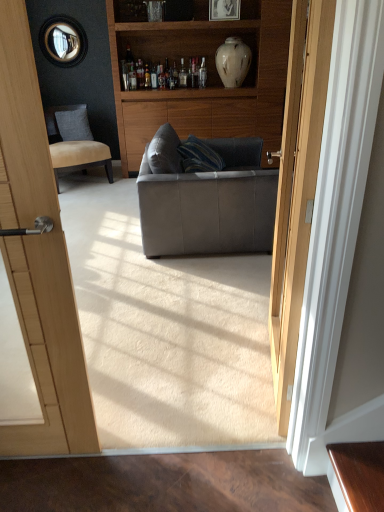
Question: Is white glossy vase at upper center positioned beyond the bounds of suede tan chair at left?

Choices:
 (A) yes
 (B) no

Answer: (A)

Question: Does white glossy vase at upper center appear on the left side of suede tan chair at left?

Choices:
 (A) no
 (B) yes

Answer: (A)

Question: Considering the relative sizes of white glossy vase at upper center and suede tan chair at left in the image provided, is white glossy vase at upper center smaller than suede tan chair at left?

Choices:
 (A) yes
 (B) no

Answer: (A)

Question: Does white glossy vase at upper center contain suede tan chair at left?

Choices:
 (A) yes
 (B) no

Answer: (B)

Question: Is white glossy vase at upper center to the right of suede tan chair at left from the viewer's perspective?

Choices:
 (A) yes
 (B) no

Answer: (A)

Question: Is wooden cabinet at center taller or shorter than leather couch at center?

Choices:
 (A) short
 (B) tall

Answer: (B)

Question: Looking at their shapes, would you say wooden cabinet at center is wider or thinner than leather couch at center?

Choices:
 (A) wide
 (B) thin

Answer: (B)

Question: Considering the positions of point (210, 111) and point (226, 209), is point (210, 111) closer or farther from the camera than point (226, 209)?

Choices:
 (A) farther
 (B) closer

Answer: (A)

Question: From a real-world perspective, is wooden cabinet at center positioned above or below leather couch at center?

Choices:
 (A) above
 (B) below

Answer: (A)

Question: Based on their positions, is matte black picture frame at upper center located to the left or right of white glossy vase at upper center?

Choices:
 (A) left
 (B) right

Answer: (A)

Question: From a real-world perspective, relative to white glossy vase at upper center, is matte black picture frame at upper center vertically above or below?

Choices:
 (A) below
 (B) above

Answer: (B)

Question: From the image's perspective, is matte black picture frame at upper center located above or below white glossy vase at upper center?

Choices:
 (A) below
 (B) above

Answer: (B)

Question: Is matte black picture frame at upper center in front of or behind white glossy vase at upper center in the image?

Choices:
 (A) behind
 (B) front

Answer: (B)

Question: Considering the relative positions of white glossy vase at upper center and wooden cabinet at center in the image provided, is white glossy vase at upper center to the left or to the right of wooden cabinet at center?

Choices:
 (A) right
 (B) left

Answer: (A)

Question: From the image's perspective, relative to wooden cabinet at center, is white glossy vase at upper center above or below?

Choices:
 (A) above
 (B) below

Answer: (A)